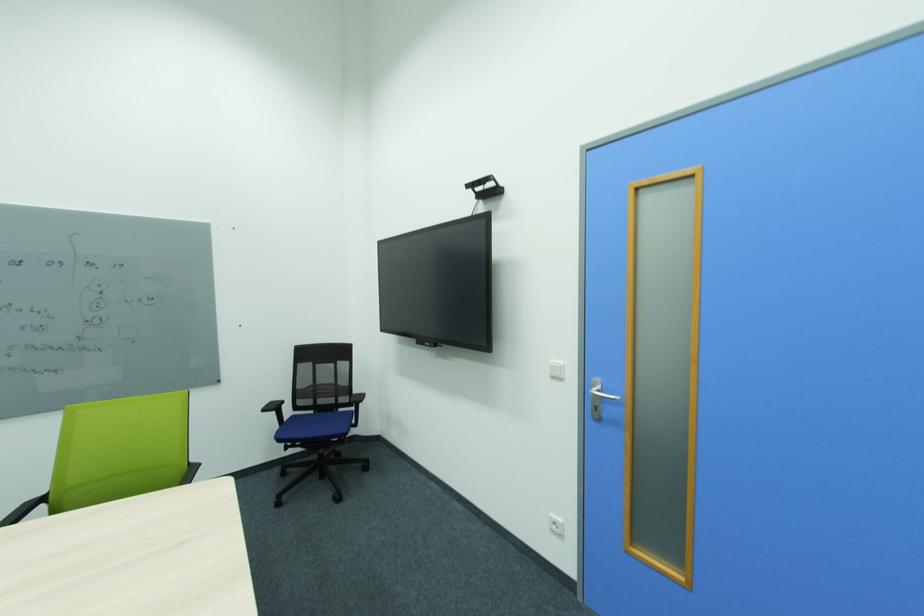
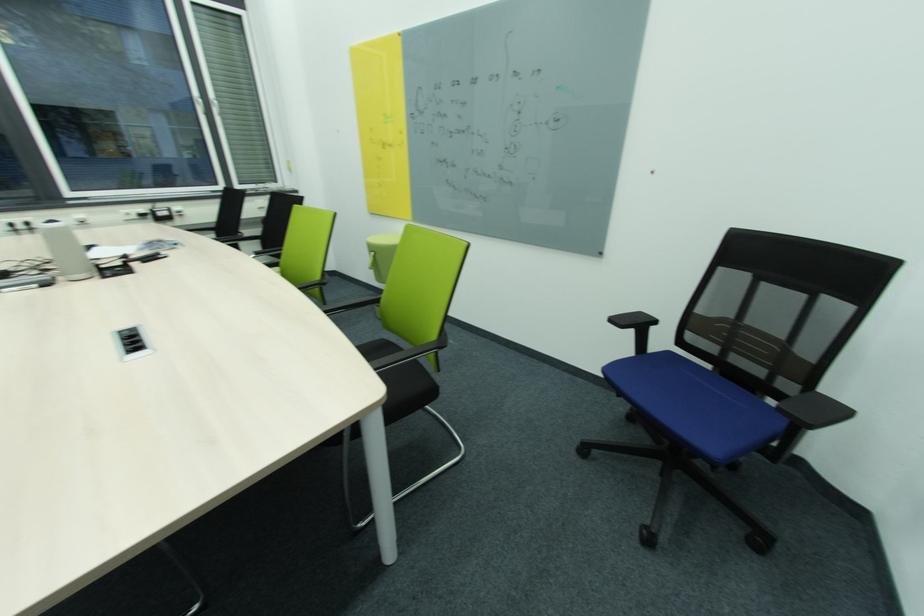
Locate, in the second image, the point that corresponds to pixel 368 397 in the first image.

(845, 411)